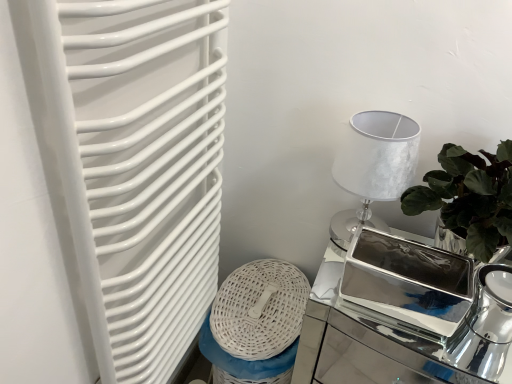
Question: Is silver metallic table lamp at upper right positioned before polished silver tray at right?

Choices:
 (A) yes
 (B) no

Answer: (B)

Question: Would you consider silver metallic table lamp at upper right to be distant from polished silver tray at right?

Choices:
 (A) no
 (B) yes

Answer: (A)

Question: Are silver metallic table lamp at upper right and polished silver tray at right making contact?

Choices:
 (A) no
 (B) yes

Answer: (A)

Question: Does silver metallic table lamp at upper right appear on the left side of polished silver tray at right?

Choices:
 (A) yes
 (B) no

Answer: (A)

Question: Can you confirm if silver metallic table lamp at upper right is thinner than polished silver tray at right?

Choices:
 (A) no
 (B) yes

Answer: (B)

Question: Is white glossy radiator at left wider or thinner than silver metallic table lamp at upper right?

Choices:
 (A) thin
 (B) wide

Answer: (A)

Question: Is point (176, 208) positioned closer to the camera than point (345, 145)?

Choices:
 (A) closer
 (B) farther

Answer: (B)

Question: From the image's perspective, is white glossy radiator at left located above or below silver metallic table lamp at upper right?

Choices:
 (A) below
 (B) above

Answer: (A)

Question: From a real-world perspective, is white glossy radiator at left physically located above or below silver metallic table lamp at upper right?

Choices:
 (A) below
 (B) above

Answer: (A)

Question: From a real-world perspective, is polished silver tray at right physically located above or below silver metallic table lamp at upper right?

Choices:
 (A) above
 (B) below

Answer: (B)

Question: In the image, is polished silver tray at right positioned in front of or behind silver metallic table lamp at upper right?

Choices:
 (A) behind
 (B) front

Answer: (B)

Question: Considering the positions of point (409, 332) and point (339, 182), is point (409, 332) closer or farther from the camera than point (339, 182)?

Choices:
 (A) farther
 (B) closer

Answer: (A)

Question: Would you say polished silver tray at right is inside or outside silver metallic table lamp at upper right?

Choices:
 (A) outside
 (B) inside

Answer: (A)

Question: Is silver metallic table lamp at upper right in front of or behind polished silver tea pot at right in the image?

Choices:
 (A) front
 (B) behind

Answer: (B)

Question: Based on their positions, is silver metallic table lamp at upper right located to the left or right of polished silver tea pot at right?

Choices:
 (A) right
 (B) left

Answer: (B)